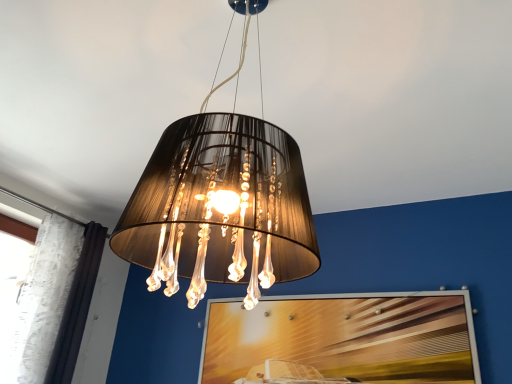
Question: Can you confirm if matte black lampshade at center is thinner than wooden textured picture frame at center?

Choices:
 (A) yes
 (B) no

Answer: (B)

Question: Is matte black lampshade at center at the right side of wooden textured picture frame at center?

Choices:
 (A) yes
 (B) no

Answer: (B)

Question: Is matte black lampshade at center not inside wooden textured picture frame at center?

Choices:
 (A) yes
 (B) no

Answer: (A)

Question: Considering the relative sizes of matte black lampshade at center and wooden textured picture frame at center in the image provided, is matte black lampshade at center bigger than wooden textured picture frame at center?

Choices:
 (A) no
 (B) yes

Answer: (B)

Question: Is matte black lampshade at center at the left side of wooden textured picture frame at center?

Choices:
 (A) yes
 (B) no

Answer: (A)

Question: In terms of height, does wooden textured picture frame at center look taller or shorter compared to matte black lampshade at center?

Choices:
 (A) tall
 (B) short

Answer: (B)

Question: Is wooden textured picture frame at center bigger or smaller than matte black lampshade at center?

Choices:
 (A) big
 (B) small

Answer: (B)

Question: Looking at their shapes, would you say wooden textured picture frame at center is wider or thinner than matte black lampshade at center?

Choices:
 (A) thin
 (B) wide

Answer: (A)

Question: From a real-world perspective, is wooden textured picture frame at center above or below matte black lampshade at center?

Choices:
 (A) below
 (B) above

Answer: (A)

Question: In terms of height, does wooden textured picture frame at center look taller or shorter compared to white lace curtain at left?

Choices:
 (A) tall
 (B) short

Answer: (B)

Question: Does point (308, 324) appear closer or farther from the camera than point (68, 271)?

Choices:
 (A) closer
 (B) farther

Answer: (A)

Question: Relative to white lace curtain at left, is wooden textured picture frame at center in front or behind?

Choices:
 (A) behind
 (B) front

Answer: (B)

Question: In terms of width, does wooden textured picture frame at center look wider or thinner when compared to white lace curtain at left?

Choices:
 (A) thin
 (B) wide

Answer: (A)

Question: Considering the relative positions of white lace curtain at left and matte black lampshade at center in the image provided, is white lace curtain at left to the left or to the right of matte black lampshade at center?

Choices:
 (A) left
 (B) right

Answer: (A)

Question: From the image's perspective, is white lace curtain at left above or below matte black lampshade at center?

Choices:
 (A) below
 (B) above

Answer: (A)